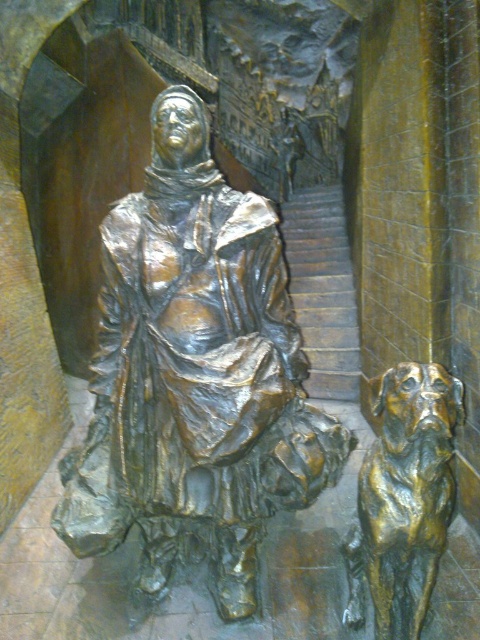
Question: Does bronze statue at center have a lesser width compared to shiny bronze dog at lower right?

Choices:
 (A) no
 (B) yes

Answer: (A)

Question: Is bronze statue at center closer to camera compared to shiny bronze dog at lower right?

Choices:
 (A) no
 (B) yes

Answer: (A)

Question: Does bronze statue at center appear on the left side of shiny bronze dog at lower right?

Choices:
 (A) yes
 (B) no

Answer: (A)

Question: Which object is farther from the camera taking this photo?

Choices:
 (A) shiny bronze dog at lower right
 (B) bronze statue at center

Answer: (B)

Question: Which point appears farthest from the camera in this image?

Choices:
 (A) (105, 330)
 (B) (439, 502)

Answer: (A)